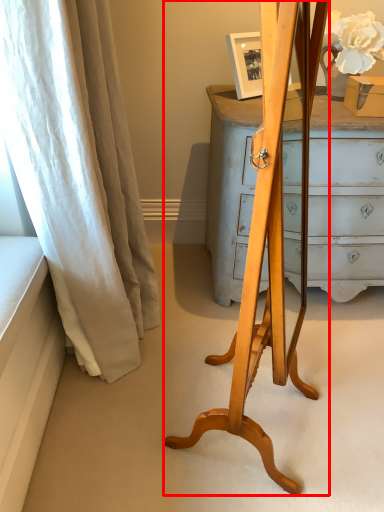
Question: From the image's perspective, where is easel (annotated by the red box) located relative to curtain?

Choices:
 (A) below
 (B) above

Answer: (A)